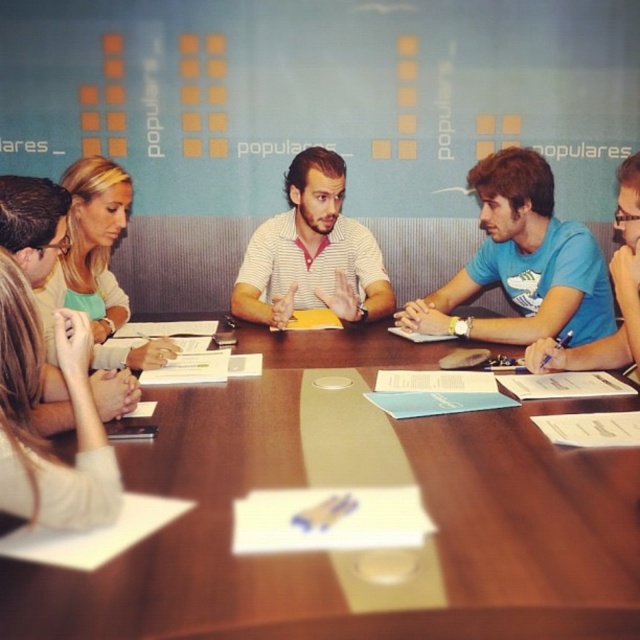
Who is positioned more to the left, wooden table at center or blue t-shirt at center?

wooden table at center is more to the left.

Can you confirm if wooden table at center is shorter than blue t-shirt at center?

Correct, wooden table at center is not as tall as blue t-shirt at center.

The height and width of the screenshot is (640, 640). What are the coordinates of `wooden table at center` in the screenshot? It's located at (326, 554).

You are a GUI agent. You are given a task and a screenshot of the screen. Output one action in this format:
    pyautogui.click(x=<x>, y=<y>)
    Task: Click on the wooden table at center
    This screenshot has height=640, width=640.
    Given the screenshot: What is the action you would take?
    pyautogui.click(x=326, y=554)

Describe the element at coordinates (522, 262) in the screenshot. The width and height of the screenshot is (640, 640). I see `blue matte shirt at center` at that location.

From the picture: Can you confirm if blue matte shirt at center is smaller than blonde hair at upper left?

No, blue matte shirt at center is not smaller than blonde hair at upper left.

Describe the element at coordinates (522, 262) in the screenshot. Image resolution: width=640 pixels, height=640 pixels. I see `blue matte shirt at center` at that location.

Where is `blue matte shirt at center`? Image resolution: width=640 pixels, height=640 pixels. blue matte shirt at center is located at coordinates (522, 262).

Who is shorter, wooden table at center or striped shirt at center?

Standing shorter between the two is wooden table at center.

Can you confirm if wooden table at center is smaller than striped shirt at center?

No.

Between point (548, 604) and point (296, 234), which one is positioned behind?

Positioned behind is point (296, 234).

Locate an element on the screen. This screenshot has height=640, width=640. wooden table at center is located at coordinates (326, 554).